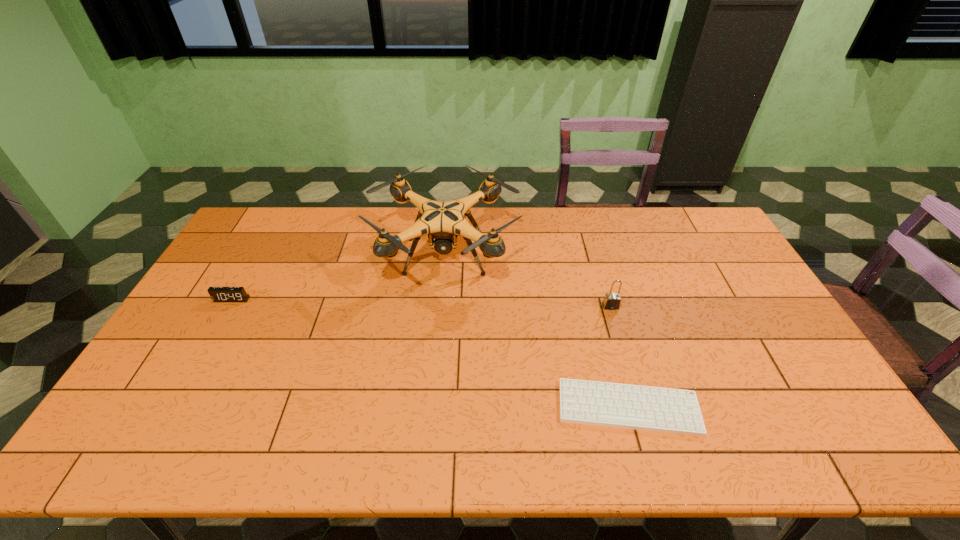
Locate an element on the screen. This screenshot has width=960, height=540. drone is located at coordinates (443, 221).

Image resolution: width=960 pixels, height=540 pixels. In order to click on the tallest object in this screenshot , I will do `click(443, 221)`.

Where is `padlock`? padlock is located at coordinates (611, 301).

Identify the location of the leftmost object. (218, 294).

Image resolution: width=960 pixels, height=540 pixels. What are the coordinates of `alarm clock` in the screenshot? It's located at tap(218, 294).

This screenshot has height=540, width=960. I want to click on the nearest object, so click(x=666, y=410).

In order to click on the shortest object in this screenshot , I will do `click(666, 410)`.

At what (x,y) coordinates should I click in order to perform the action: click on free space located on the camera mount of the third object from right to left. Please return your answer as a coordinate pair (x, y). Looking at the image, I should click on (433, 402).

Identify the location of free space located on the shackle of the third shortest object. The height and width of the screenshot is (540, 960). (623, 347).

This screenshot has width=960, height=540. In order to click on blank area located on the front-facing side of the alarm clock in this screenshot , I will do tap(175, 400).